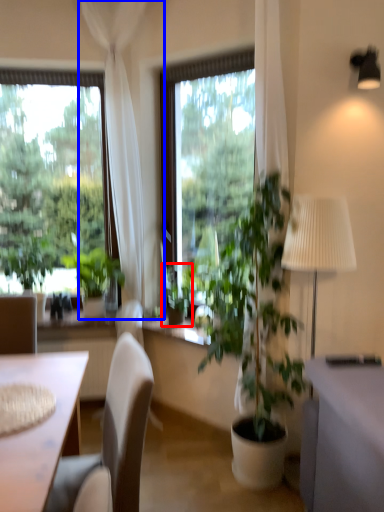
Question: Which object is closer to the camera taking this photo, houseplant (highlighted by a red box) or curtain (highlighted by a blue box)?

Choices:
 (A) houseplant
 (B) curtain

Answer: (B)